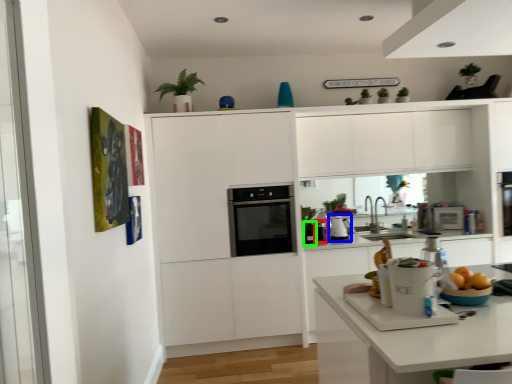
Question: Which is farther away from appliance (highlighted by a red box)? appliance (highlighted by a blue box) or appliance (highlighted by a green box)?

Choices:
 (A) appliance
 (B) appliance

Answer: (A)